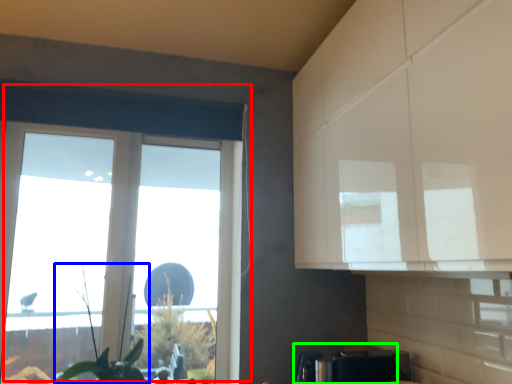
Question: Based on their relative distances, which object is farther from window (highlighted by a red box)? Choose from plant (highlighted by a blue box) and appliance (highlighted by a green box).

Choices:
 (A) plant
 (B) appliance

Answer: (B)